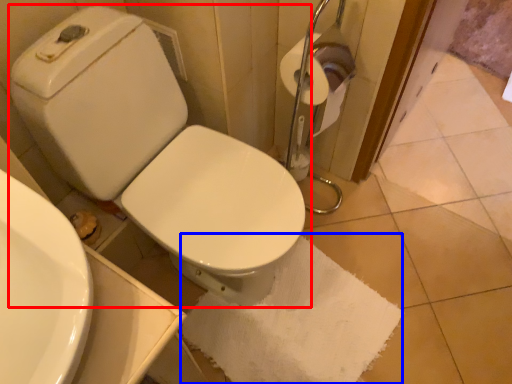
Question: Which object is further to the camera taking this photo, toilet (highlighted by a red box) or bath towel (highlighted by a blue box)?

Choices:
 (A) toilet
 (B) bath towel

Answer: (B)